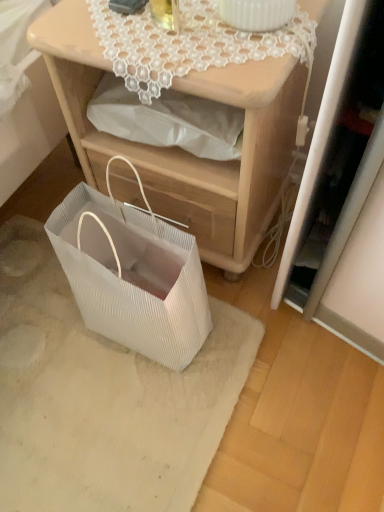
Where is `empty space that is ontop of matte wood nightstand at center (from a real-world perspective)`? The image size is (384, 512). empty space that is ontop of matte wood nightstand at center (from a real-world perspective) is located at coordinates (178, 27).